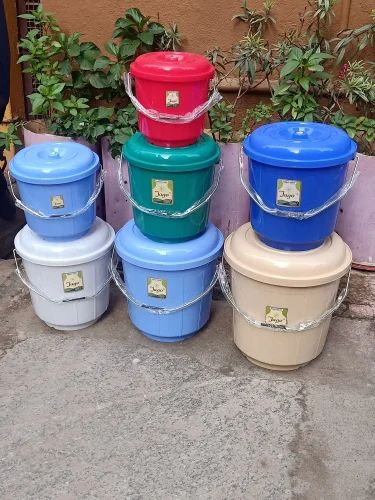
The image size is (375, 500). In order to click on red bucket in this screenshot , I will do `click(183, 94)`.